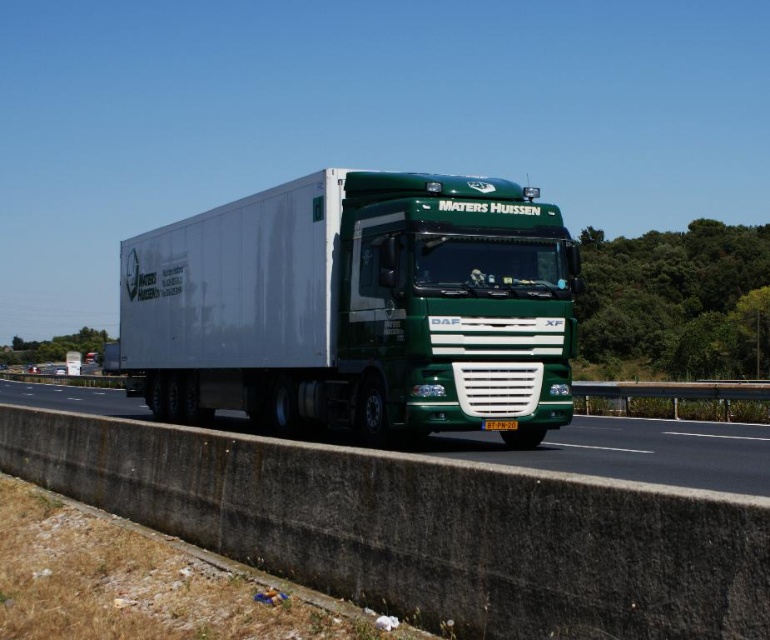
Who is positioned more to the right, green matte trailer truck at center or green matte truck at center?

From the viewer's perspective, green matte truck at center appears more on the right side.

Is green matte trailer truck at center shorter than green matte truck at center?

No, green matte trailer truck at center is not shorter than green matte truck at center.

Which is in front, point (265, 317) or point (675, 429)?

Point (265, 317) is in front.

Locate an element on the screen. green matte trailer truck at center is located at coordinates (357, 308).